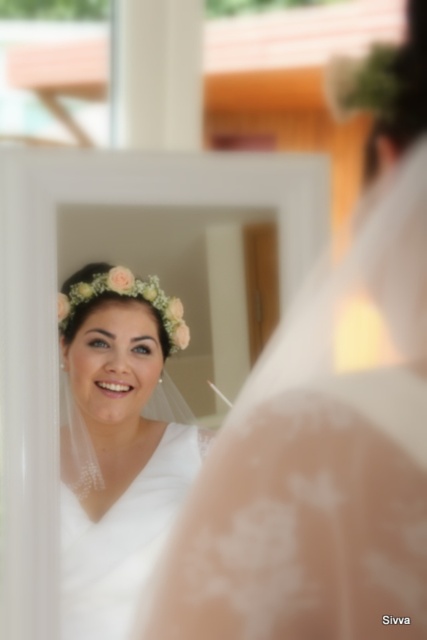
You are a photographer adjusting lighting for a portrait. You notice the white lace veil at upper left and the white lace dress at center in the mirror reflection. Which object should you focus on first if you want to highlight the one closer to the camera?

The white lace veil at upper left is located above the white lace dress at center, so it is closer to the camera. Therefore, focus on the white lace veil at upper left first to highlight the closer object.

You are a photographer adjusting the lighting for a portrait. You need to ensure the white lace veil at upper left and the white lace dress at center are both well lit. Based on their positions, which object should you adjust the light towards first?

The white lace veil at upper left is to the right of the white lace dress at center, so you should adjust the light towards the white lace veil at upper left first to ensure both are properly illuminated.

You are taking a photo of the bride reflected in the mirror. You want to focus on the point that is closer to the camera. Which point should you choose between point (251, 515) and point (126, 332)?

Point (251, 515) is closer to the camera than point (126, 332), so you should choose point (251, 515) to focus on.